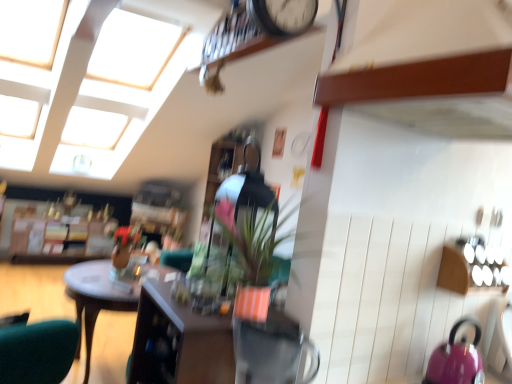
Question: From a real-world perspective, is matte orange pot at center above or below pink glossy kettle at lower right?

Choices:
 (A) above
 (B) below

Answer: (A)

Question: Based on their sizes in the image, would you say matte orange pot at center is bigger or smaller than pink glossy kettle at lower right?

Choices:
 (A) small
 (B) big

Answer: (B)

Question: Based on their relative distances, which object is farther from the matte wooden cabinet at center?

Choices:
 (A) matte orange pot at center
 (B) wooden desk at center
 (C) pink glossy kettle at lower right

Answer: (B)

Question: Which is farther from the pink glossy kettle at lower right?

Choices:
 (A) matte wooden cabinet at center
 (B) wooden desk at center
 (C) matte orange pot at center

Answer: (B)